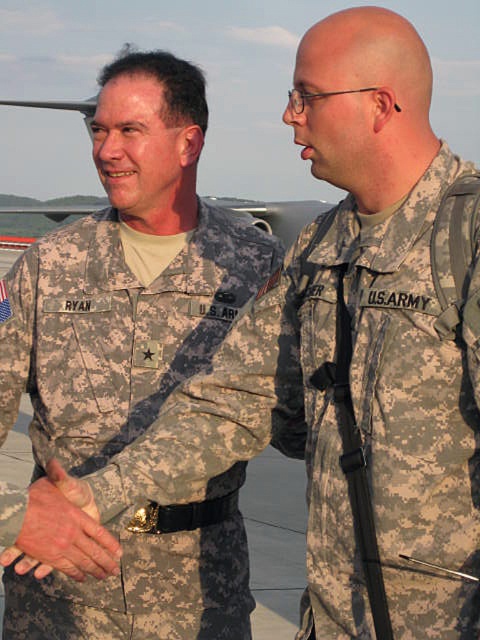
You are a photographer at a military base and need to capture a photo of the two soldiers. You want to ensure that the soldier in the camouflage fabric us army uniform at right is on the right side of the camouflage fabric uniform at center in the final image. Based on the scene description, will this arrangement naturally occur without needing to adjust their positions?

Yes, the camouflage fabric us army uniform at right is already positioned on the right side of the camouflage fabric uniform at center, so the arrangement will naturally occur without needing adjustments.